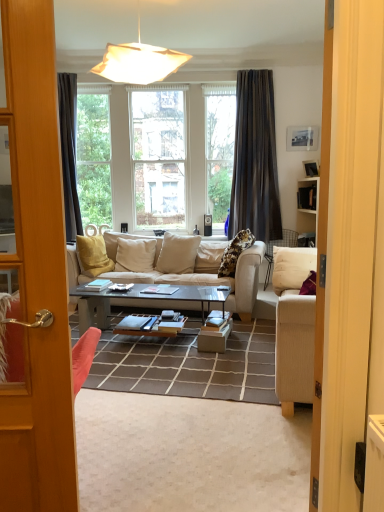
Locate an element on the screen. The image size is (384, 512). vacant region in front of shiny black glass coffee table at center is located at coordinates (158, 376).